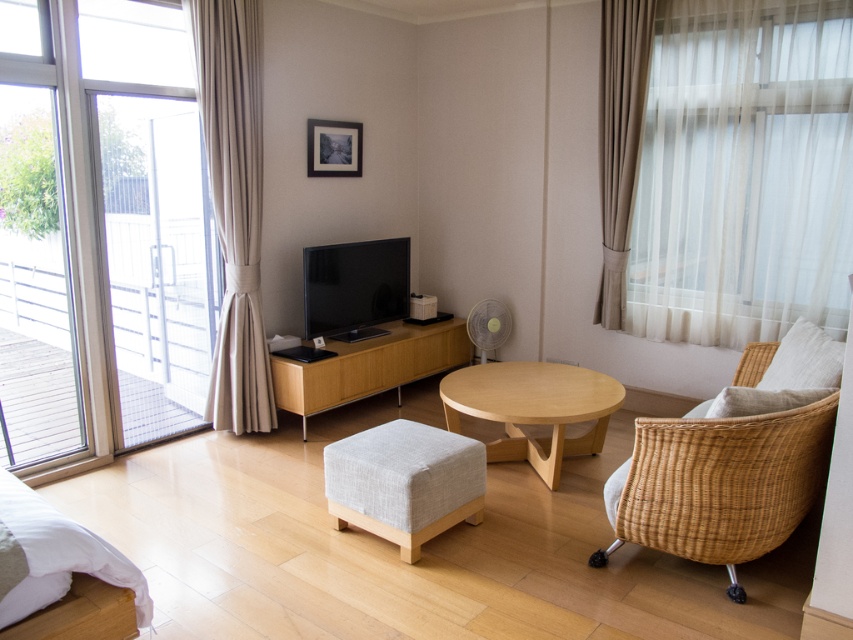
Is sheer white curtain at right wider than beige fabric curtain at right?

Yes, sheer white curtain at right is wider than beige fabric curtain at right.

Can you confirm if sheer white curtain at right is taller than beige fabric curtain at right?

Indeed, sheer white curtain at right has a greater height compared to beige fabric curtain at right.

What do you see at coordinates (743, 172) in the screenshot? Image resolution: width=853 pixels, height=640 pixels. I see `sheer white curtain at right` at bounding box center [743, 172].

The image size is (853, 640). I want to click on sheer white curtain at right, so click(x=743, y=172).

Consider the image. Does natural wood round table at center appear on the right side of beige fabric curtain at right?

No, natural wood round table at center is not to the right of beige fabric curtain at right.

From the picture: Between natural wood round table at center and beige fabric curtain at right, which one is positioned lower?

natural wood round table at center is below.

Image resolution: width=853 pixels, height=640 pixels. Describe the element at coordinates (532, 408) in the screenshot. I see `natural wood round table at center` at that location.

Find the location of a particular element. Image resolution: width=853 pixels, height=640 pixels. natural wood round table at center is located at coordinates (532, 408).

Is clear glass door at left taller than transparent glass door at left?

Yes.

Measure the distance between clear glass door at left and transparent glass door at left.

clear glass door at left and transparent glass door at left are 5.39 inches apart from each other.

What do you see at coordinates (100, 230) in the screenshot? I see `clear glass door at left` at bounding box center [100, 230].

The image size is (853, 640). In order to click on clear glass door at left in this screenshot , I will do `click(100, 230)`.